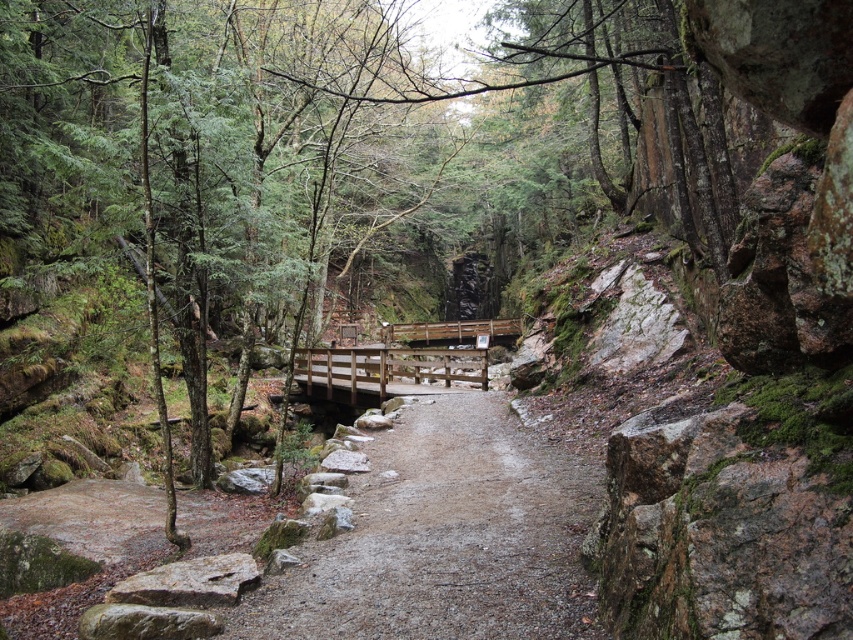
In the scene shown: Is damp gravel path at center above gray rough rock at lower left?

Indeed, damp gravel path at center is positioned over gray rough rock at lower left.

Which of these two, damp gravel path at center or gray rough rock at lower left, stands taller?

Standing taller between the two is damp gravel path at center.

Locate an element on the screen. This screenshot has height=640, width=853. damp gravel path at center is located at coordinates (445, 538).

Locate an element on the screen. damp gravel path at center is located at coordinates (445, 538).

Is point (532, 515) in front of point (344, 381)?

Yes, it is.

Where is `damp gravel path at center`? The height and width of the screenshot is (640, 853). damp gravel path at center is located at coordinates (445, 538).

Can you confirm if wooden bridge at center is shorter than gray rough rock at lower left?

No.

Does wooden bridge at center have a greater width compared to gray rough rock at lower left?

Yes, wooden bridge at center is wider than gray rough rock at lower left.

The height and width of the screenshot is (640, 853). I want to click on wooden bridge at center, so click(405, 356).